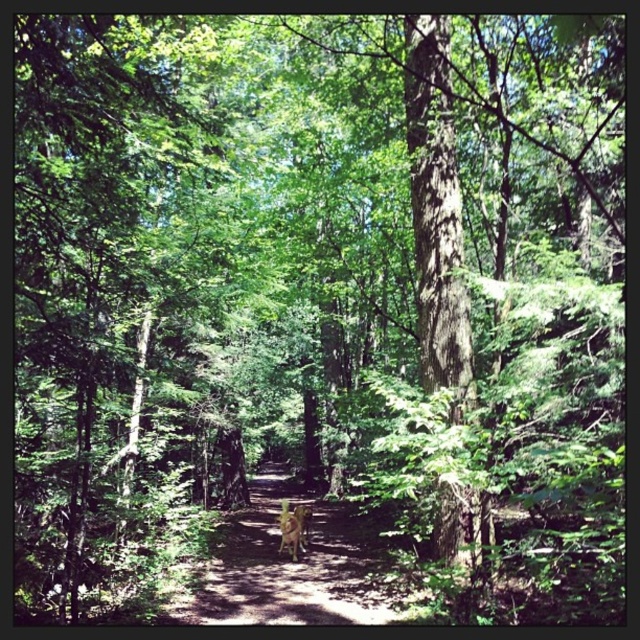
Based on the photo, does brown textured path at center have a smaller size compared to brown wooden bench at center?

Actually, brown textured path at center might be larger than brown wooden bench at center.

Who is taller, brown textured path at center or brown wooden bench at center?

brown textured path at center is taller.

This screenshot has height=640, width=640. What do you see at coordinates (289, 566) in the screenshot? I see `brown textured path at center` at bounding box center [289, 566].

Identify the location of brown textured path at center. (289, 566).